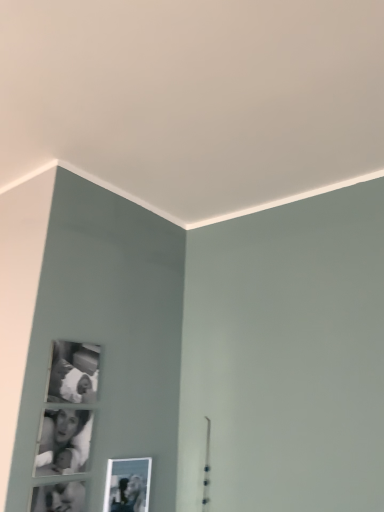
Question: Does black matte photo frame at upper left, arranged as the 2th picture frame when viewed from the right, come behind metallic silver photo frame at lower center, which appears as the second picture frame when viewed from the top?

Choices:
 (A) no
 (B) yes

Answer: (A)

Question: Is black matte photo frame at upper left, arranged as the 2th picture frame when viewed from the right, bigger than metallic silver photo frame at lower center, the second picture frame in the left-to-right sequence?

Choices:
 (A) no
 (B) yes

Answer: (A)

Question: Is metallic silver photo frame at lower center, which appears as the first picture frame when viewed from the right, at the back of black matte photo frame at upper left, which is the 2th picture frame in bottom-to-top order?

Choices:
 (A) yes
 (B) no

Answer: (B)

Question: From the image's perspective, does black matte photo frame at upper left, which is the 2th picture frame in bottom-to-top order, appear higher than metallic silver photo frame at lower center, the second picture frame in the left-to-right sequence?

Choices:
 (A) no
 (B) yes

Answer: (B)

Question: Is there a large distance between black matte photo frame at upper left, arranged as the first picture frame when viewed from the left, and metallic silver photo frame at lower center, the first picture frame in the bottom-to-top sequence?

Choices:
 (A) no
 (B) yes

Answer: (A)

Question: Considering the positions of point (135, 481) and point (84, 439), is point (135, 481) closer or farther from the camera than point (84, 439)?

Choices:
 (A) farther
 (B) closer

Answer: (A)

Question: Considering the positions of metallic silver photo frame at lower center, the first picture frame in the bottom-to-top sequence, and black glossy photo frame at lower left in the image, is metallic silver photo frame at lower center, the first picture frame in the bottom-to-top sequence, bigger or smaller than black glossy photo frame at lower left?

Choices:
 (A) small
 (B) big

Answer: (B)

Question: From the image's perspective, is metallic silver photo frame at lower center, which appears as the first picture frame when viewed from the right, positioned above or below black glossy photo frame at lower left?

Choices:
 (A) above
 (B) below

Answer: (B)

Question: Looking at their shapes, would you say metallic silver photo frame at lower center, the second picture frame in the left-to-right sequence, is wider or thinner than black glossy photo frame at lower left?

Choices:
 (A) thin
 (B) wide

Answer: (B)

Question: From the image's perspective, is black glossy photo frame at lower left positioned above or below metallic silver photo frame at lower center, which appears as the first picture frame when viewed from the right?

Choices:
 (A) below
 (B) above

Answer: (B)

Question: From a real-world perspective, is black glossy photo frame at lower left physically located above or below metallic silver photo frame at lower center, the first picture frame in the bottom-to-top sequence?

Choices:
 (A) below
 (B) above

Answer: (B)

Question: In terms of size, does black glossy photo frame at lower left appear bigger or smaller than metallic silver photo frame at lower center, which appears as the second picture frame when viewed from the top?

Choices:
 (A) small
 (B) big

Answer: (A)

Question: Considering their positions, is black glossy photo frame at lower left located in front of or behind metallic silver photo frame at lower center, which appears as the first picture frame when viewed from the right?

Choices:
 (A) front
 (B) behind

Answer: (A)

Question: From their relative heights in the image, would you say black matte photo frame at upper left, positioned as the 1th picture frame in top-to-bottom order, is taller or shorter than black glossy photo frame at lower left?

Choices:
 (A) short
 (B) tall

Answer: (B)

Question: In the image, is black matte photo frame at upper left, arranged as the 2th picture frame when viewed from the right, positioned in front of or behind black glossy photo frame at lower left?

Choices:
 (A) front
 (B) behind

Answer: (B)